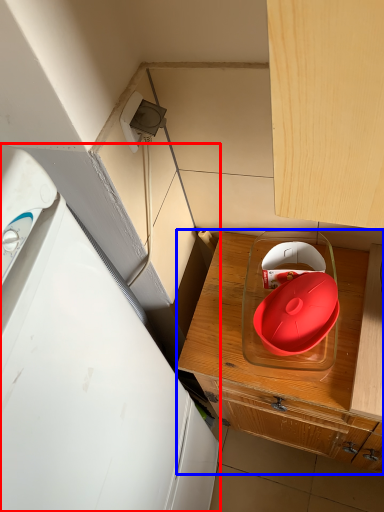
Question: Which object is closer to the camera taking this photo, home appliance (highlighted by a red box) or cabinetry (highlighted by a blue box)?

Choices:
 (A) home appliance
 (B) cabinetry

Answer: (A)